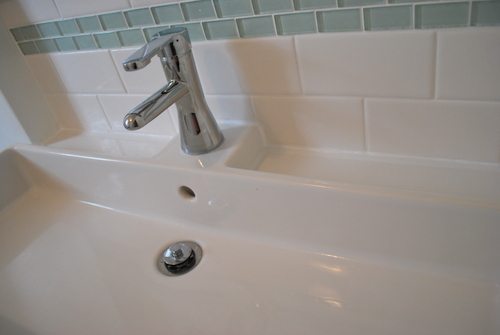
The image size is (500, 335). What are the coordinates of `sink stopper` in the screenshot? It's located at (167, 266), (190, 254), (171, 248).